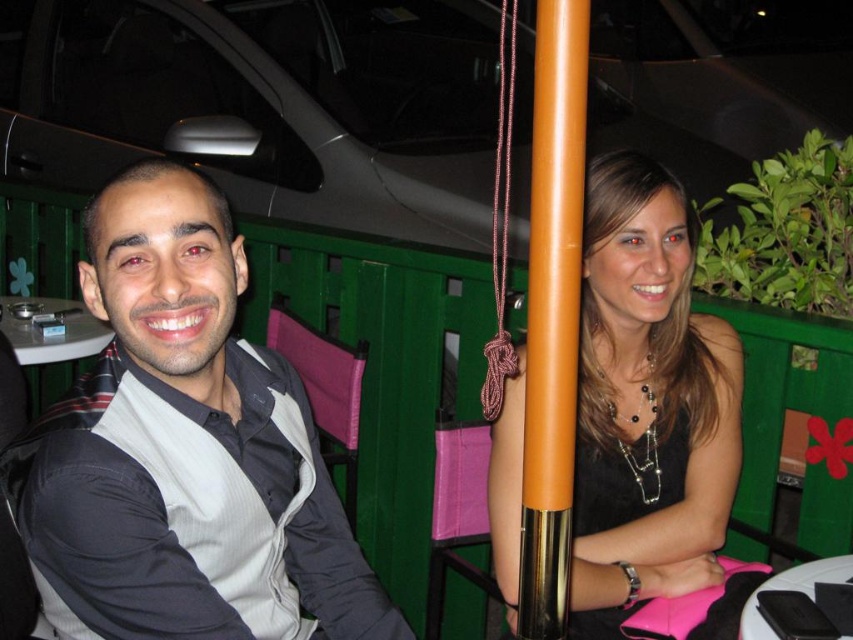
Question: Which point appears closest to the camera in this image?

Choices:
 (A) (529, 396)
 (B) (753, 625)

Answer: (A)

Question: Which point appears closest to the camera in this image?

Choices:
 (A) (247, 438)
 (B) (556, 141)

Answer: (B)

Question: Does gray fabric shirt at left have a smaller size compared to white glossy table at lower right?

Choices:
 (A) no
 (B) yes

Answer: (A)

Question: Is black satin dress at center thinner than orange glossy pole at center?

Choices:
 (A) no
 (B) yes

Answer: (A)

Question: Does gray fabric shirt at left have a greater width compared to orange glossy pole at center?

Choices:
 (A) no
 (B) yes

Answer: (B)

Question: Which is farther from the white glossy table at lower left?

Choices:
 (A) gray fabric shirt at left
 (B) white glossy table at lower right
 (C) black satin dress at center
 (D) orange glossy pole at center

Answer: (B)